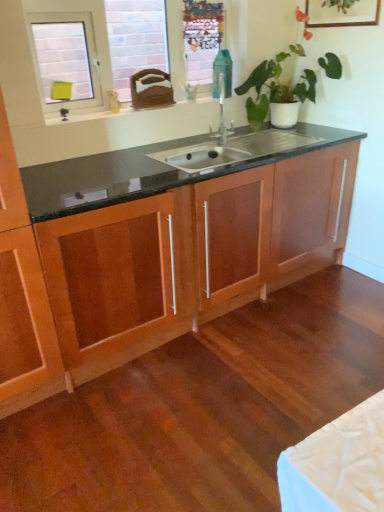
What is the approximate width of metallic mesh at upper center?

The width of metallic mesh at upper center is 1.58 centimeters.

The height and width of the screenshot is (512, 384). What do you see at coordinates (342, 14) in the screenshot? I see `wooden picture frame at upper right` at bounding box center [342, 14].

Image resolution: width=384 pixels, height=512 pixels. Find the location of `wooden cabinet at center`. wooden cabinet at center is located at coordinates (164, 254).

You are a GUI agent. You are given a task and a screenshot of the screen. Output one action in this format:
    pyautogui.click(x=<x>, y=<y>)
    Task: Click on the metallic mesh at upper center
    Image resolution: width=384 pixels, height=512 pixels.
    Given the screenshot: What is the action you would take?
    pyautogui.click(x=201, y=39)

Considering the positions of objects green glossy plant at upper center and white glossy window sill at upper left in the image provided, who is in front, green glossy plant at upper center or white glossy window sill at upper left?

green glossy plant at upper center is closer to the camera.

Is green glossy plant at upper center inside or outside of white glossy window sill at upper left?

green glossy plant at upper center is located beyond the bounds of white glossy window sill at upper left.

Is green glossy plant at upper center far from white glossy window sill at upper left?

They are positioned close to each other.

Is green glossy plant at upper center wider than white glossy window sill at upper left?

Indeed, green glossy plant at upper center has a greater width compared to white glossy window sill at upper left.

Is white glossy window sill at upper left next to white glossy window at upper left?

No, white glossy window sill at upper left is not in contact with white glossy window at upper left.

From the image's perspective, which is above, white glossy window sill at upper left or white glossy window at upper left?

white glossy window at upper left.

How different are the orientations of white glossy window sill at upper left and white glossy window at upper left in degrees?

0.457 degrees.

Can you tell me how much white glossy window sill at upper left and metallic mesh at upper center differ in facing direction?

The angular difference between white glossy window sill at upper left and metallic mesh at upper center is 2.36 degrees.

Which point is more distant from viewer, [146,109] or [203,79]?

Positioned behind is point [203,79].

Considering the sizes of white glossy window sill at upper left and metallic mesh at upper center in the image, is white glossy window sill at upper left wider or thinner than metallic mesh at upper center?

Considering their sizes, white glossy window sill at upper left looks broader than metallic mesh at upper center.

From the picture: Who is shorter, wooden picture frame at upper right or green glossy plant at upper center?

wooden picture frame at upper right is shorter.

Is point (314, 14) positioned after point (308, 78)?

No.

From a real-world perspective, is wooden picture frame at upper right located higher than green glossy plant at upper center?

Yes, from a real-world perspective, wooden picture frame at upper right is above green glossy plant at upper center.

Is wooden picture frame at upper right in front of green glossy plant at upper center?

No.

Locate an element on the screen. The image size is (384, 512). window screen that appears on the right of white glossy window sill at upper left is located at coordinates (201, 39).

Is point (200, 9) farther from camera compared to point (169, 106)?

That is True.

Are metallic mesh at upper center and white glossy window sill at upper left located far from each other?

No, metallic mesh at upper center is not far from white glossy window sill at upper left.

Who is shorter, metallic mesh at upper center or white glossy window sill at upper left?

Standing shorter between the two is white glossy window sill at upper left.

Does white glossy window sill at upper left have a larger size compared to wooden picture frame at upper right?

Yes.

From the image's perspective, is white glossy window sill at upper left below wooden picture frame at upper right?

Yes, from the image's perspective, white glossy window sill at upper left is below wooden picture frame at upper right.

From a real-world perspective, which is physically below, white glossy window sill at upper left or wooden picture frame at upper right?

white glossy window sill at upper left, from a real-world perspective.

Is white glossy window sill at upper left at the left side of wooden picture frame at upper right?

Yes, white glossy window sill at upper left is to the left of wooden picture frame at upper right.

Would you say white glossy window at upper left is a long distance from metallic mesh at upper center?

No, white glossy window at upper left is in close proximity to metallic mesh at upper center.

Is white glossy window at upper left turned away from metallic mesh at upper center?

Yes, white glossy window at upper left is facing away from metallic mesh at upper center.

In terms of width, does white glossy window at upper left look wider or thinner when compared to metallic mesh at upper center?

In the image, white glossy window at upper left appears to be wider than metallic mesh at upper center.

Relative to metallic mesh at upper center, is white glossy window at upper left in front or behind?

In the image, white glossy window at upper left appears in front of metallic mesh at upper center.

The image size is (384, 512). Find the location of `window sill that is behind the green glossy plant at upper center`. window sill that is behind the green glossy plant at upper center is located at coordinates (153, 115).

You are a GUI agent. You are given a task and a screenshot of the screen. Output one action in this format:
    pyautogui.click(x=<x>, y=<y>)
    Task: Click on the window that is above the white glossy window sill at upper left (from a real-world perspective)
    Image resolution: width=384 pixels, height=512 pixels.
    Given the screenshot: What is the action you would take?
    [93, 25]

When comparing their distances from wooden picture frame at upper right, does wooden cabinet at center or metallic mesh at upper center seem closer?

metallic mesh at upper center lies closer to wooden picture frame at upper right than the other object.

Based on their spatial positions, is white glossy window sill at upper left or wooden cabinet at center closer to wooden picture frame at upper right?

Based on the image, white glossy window sill at upper left appears to be nearer to wooden picture frame at upper right.

From the image, which object appears to be farther from green glossy plant at upper center, metallic mesh at upper center or white glossy window at upper left?

white glossy window at upper left is positioned further to the anchor green glossy plant at upper center.

From the image, which object appears to be farther from metallic mesh at upper center, white glossy window sill at upper left or wooden picture frame at upper right?

wooden picture frame at upper right lies further to metallic mesh at upper center than the other object.

Based on their spatial positions, is metallic mesh at upper center or white glossy window at upper left closer to wooden picture frame at upper right?

metallic mesh at upper center is positioned closer to the anchor wooden picture frame at upper right.

Looking at the image, which one is located closer to metallic mesh at upper center, green glossy plant at upper center or wooden cabinet at center?

Among the two, green glossy plant at upper center is located nearer to metallic mesh at upper center.

Based on the photo, estimate the real-world distances between objects in this image. Which object is closer to wooden picture frame at upper right, wooden cabinet at center or white glossy window sill at upper left?

white glossy window sill at upper left is closer to wooden picture frame at upper right.

Looking at the image, which one is located further to green glossy plant at upper center, white glossy window sill at upper left or wooden picture frame at upper right?

Based on the image, white glossy window sill at upper left appears to be further to green glossy plant at upper center.

Find the location of a particular element. This screenshot has height=512, width=384. window that lies between metallic mesh at upper center and white glossy window sill at upper left from top to bottom is located at coordinates (93, 25).

Image resolution: width=384 pixels, height=512 pixels. Find the location of `houseplant between white glossy window sill at upper left and wooden picture frame at upper right from left to right`. houseplant between white glossy window sill at upper left and wooden picture frame at upper right from left to right is located at coordinates pyautogui.click(x=276, y=86).

The height and width of the screenshot is (512, 384). What are the coordinates of `window sill between white glossy window at upper left and wooden cabinet at center from top to bottom` in the screenshot? It's located at (153, 115).

At what (x,y) coordinates should I click in order to perform the action: click on window sill between green glossy plant at upper center and wooden cabinet at center in the up-down direction. Please return your answer as a coordinate pair (x, y). The width and height of the screenshot is (384, 512). Looking at the image, I should click on (153, 115).